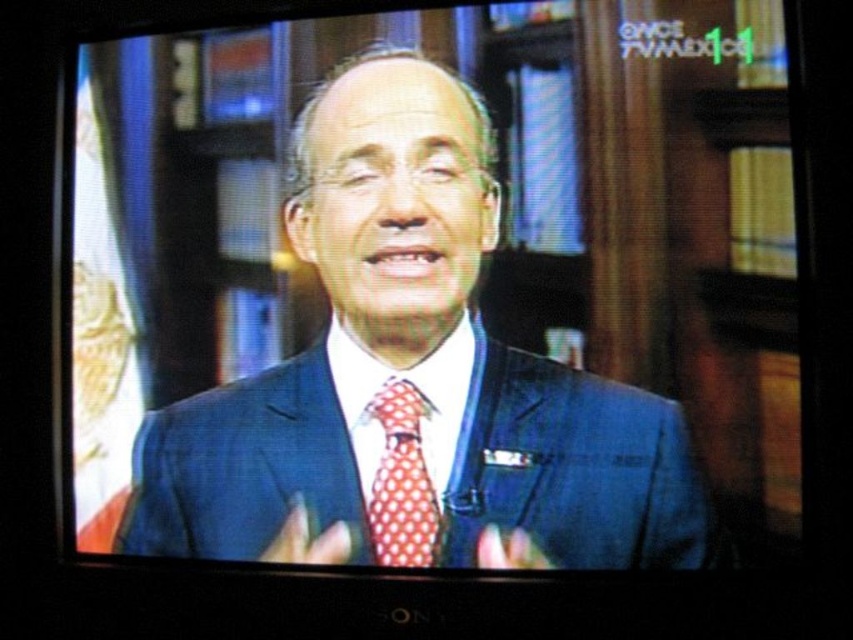
Consider the image. Where is the blue textured suit at center located in the image?

The blue textured suit at center is located at point coordinates of (x=573, y=467).

You are a fashion designer analyzing the TV image. You notice the blue suit at center and the polka dot silk tie at center. Which clothing item is located to the left of the other?

The blue suit at center is positioned on the left side of polka dot silk tie at center.